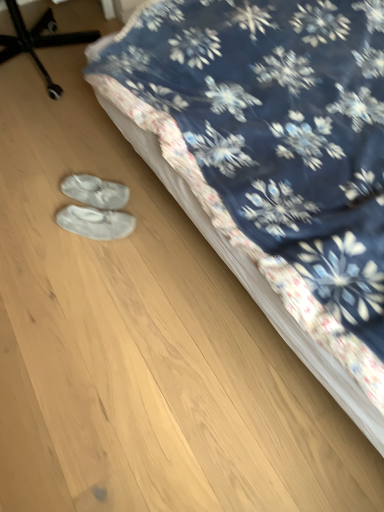
This screenshot has height=512, width=384. What are the coordinates of `free space in front of white suede slippers at lower center, which is the second footwear from top to bottom` in the screenshot? It's located at (91, 268).